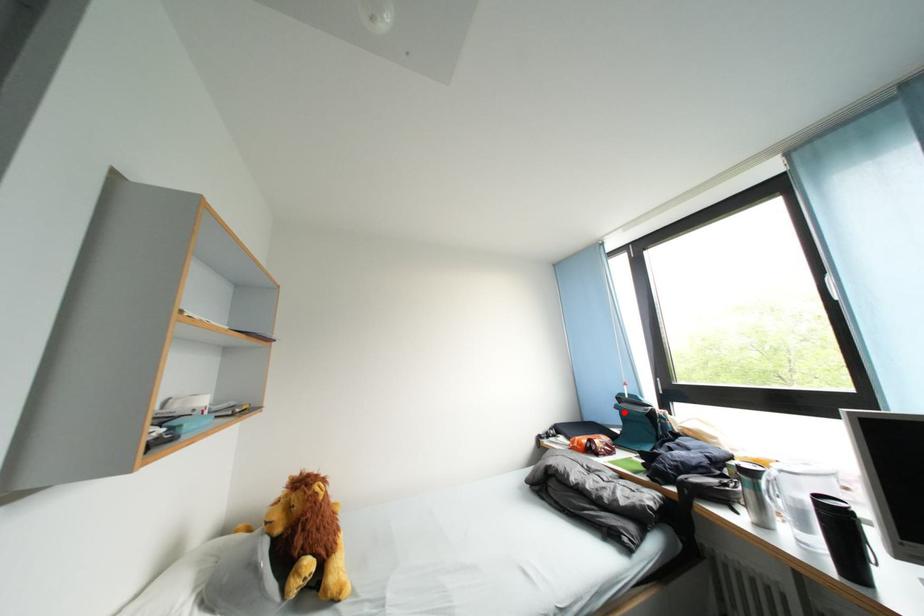
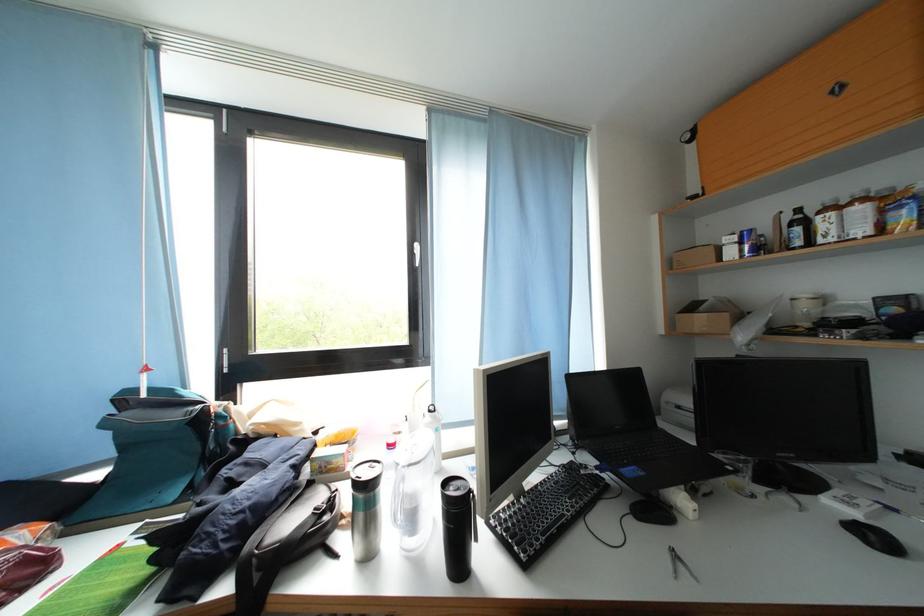
Question: I am providing you with two images of the same scene from different viewpoints. Image1 has a red point marked. In image2, the corresponding 3D location appears at what relative position? Reply with the corresponding letter.

Choices:
 (A) Closer
 (B) Farther

Answer: (A)